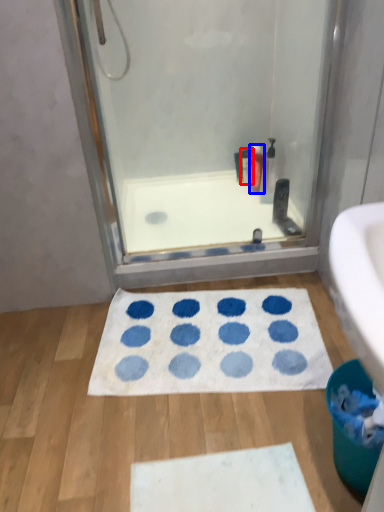
Question: Which object is further to the camera taking this photo, toiletry (highlighted by a red box) or cleaning product (highlighted by a blue box)?

Choices:
 (A) toiletry
 (B) cleaning product

Answer: (A)